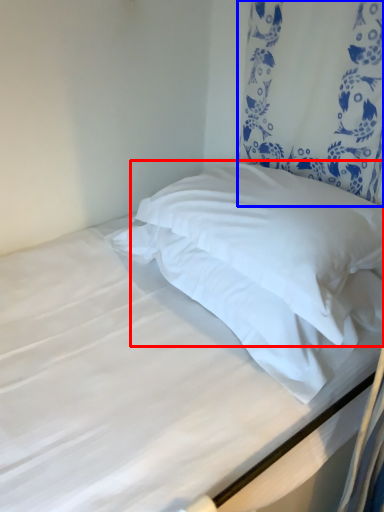
Question: Which object is further to the camera taking this photo, pillow (highlighted by a red box) or curtain (highlighted by a blue box)?

Choices:
 (A) pillow
 (B) curtain

Answer: (B)